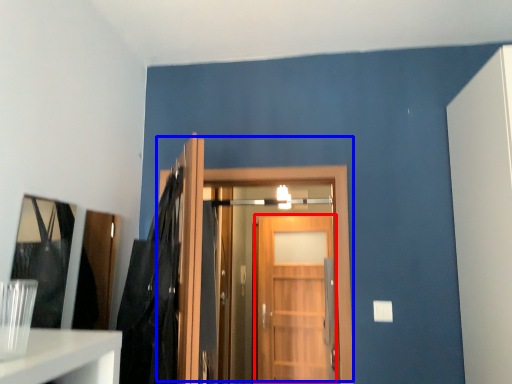
Question: Among these objects, which one is farthest to the camera, door (highlighted by a red box) or door (highlighted by a blue box)?

Choices:
 (A) door
 (B) door

Answer: (A)